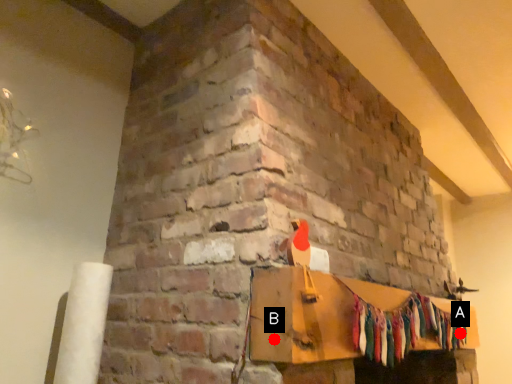
Question: Two points are circled on the image, labeled by A and B beside each circle. Which point is farther from the camera taking this photo?

Choices:
 (A) A is further
 (B) B is further

Answer: (A)